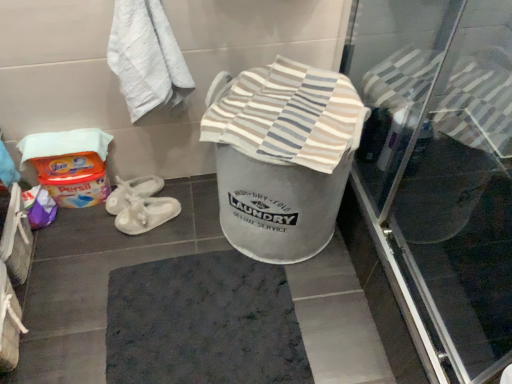
Question: Is transparent glass screen door at upper right facing away from dark gray textured bath mat at center?

Choices:
 (A) yes
 (B) no

Answer: (B)

Question: Is transparent glass screen door at upper right far from dark gray textured bath mat at center?

Choices:
 (A) yes
 (B) no

Answer: (B)

Question: Is transparent glass screen door at upper right aimed at dark gray textured bath mat at center?

Choices:
 (A) yes
 (B) no

Answer: (B)

Question: From a real-world perspective, is transparent glass screen door at upper right on top of dark gray textured bath mat at center?

Choices:
 (A) no
 (B) yes

Answer: (B)

Question: From the image's perspective, would you say transparent glass screen door at upper right is positioned over dark gray textured bath mat at center?

Choices:
 (A) no
 (B) yes

Answer: (B)

Question: In terms of height, does transparent glass screen door at upper right look taller or shorter compared to striped cotton towel at center?

Choices:
 (A) tall
 (B) short

Answer: (A)

Question: From the image's perspective, is transparent glass screen door at upper right above or below striped cotton towel at center?

Choices:
 (A) below
 (B) above

Answer: (A)

Question: Looking at the image, does transparent glass screen door at upper right seem bigger or smaller compared to striped cotton towel at center?

Choices:
 (A) big
 (B) small

Answer: (A)

Question: Do you think transparent glass screen door at upper right is within striped cotton towel at center, or outside of it?

Choices:
 (A) outside
 (B) inside

Answer: (A)

Question: Would you say transparent glass screen door at upper right is to the left or to the right of dark gray textured bath mat at center in the picture?

Choices:
 (A) right
 (B) left

Answer: (A)

Question: From a real-world perspective, is transparent glass screen door at upper right above or below dark gray textured bath mat at center?

Choices:
 (A) below
 (B) above

Answer: (B)

Question: Is point (388, 198) closer or farther from the camera than point (232, 319)?

Choices:
 (A) farther
 (B) closer

Answer: (B)

Question: Considering the positions of transparent glass screen door at upper right and dark gray textured bath mat at center in the image, is transparent glass screen door at upper right wider or thinner than dark gray textured bath mat at center?

Choices:
 (A) wide
 (B) thin

Answer: (B)

Question: Relative to white textured towel at upper left, is dark gray textured bath mat at center in front or behind?

Choices:
 (A) behind
 (B) front

Answer: (A)

Question: From their relative heights in the image, would you say dark gray textured bath mat at center is taller or shorter than white textured towel at upper left?

Choices:
 (A) short
 (B) tall

Answer: (A)